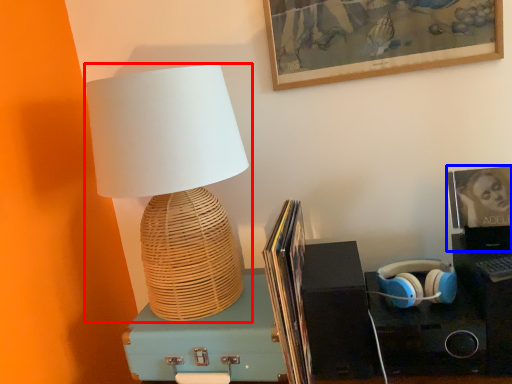
Question: Which point is closer to the camera, lamp (highlighted by a red box) or picture frame (highlighted by a blue box)?

Choices:
 (A) lamp
 (B) picture frame

Answer: (A)